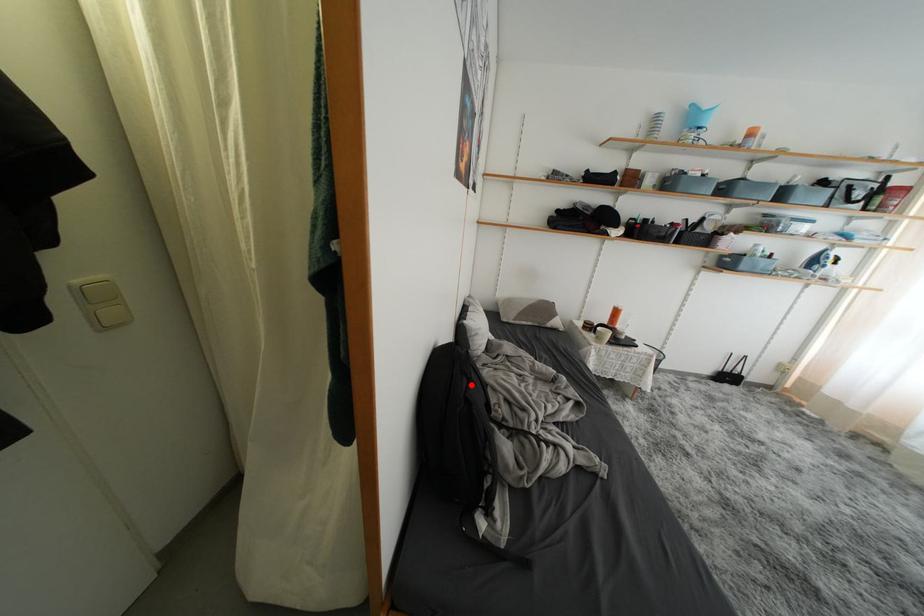
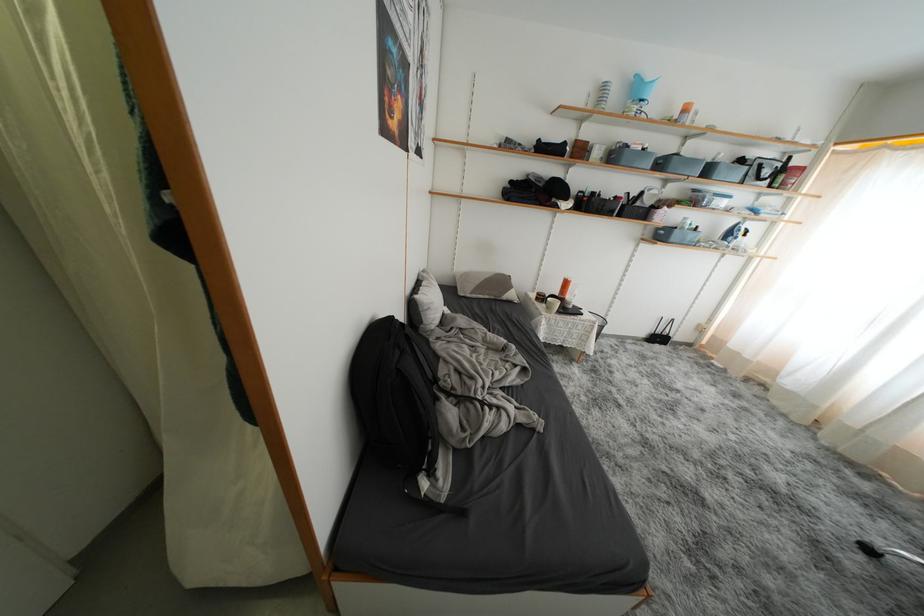
Question: I am providing you with two images of the same scene from different viewpoints. Given a red point in image1, look at the same physical point in image2. Is it:

Choices:
 (A) Closer to the viewpoint
 (B) Farther from the viewpoint

Answer: (B)